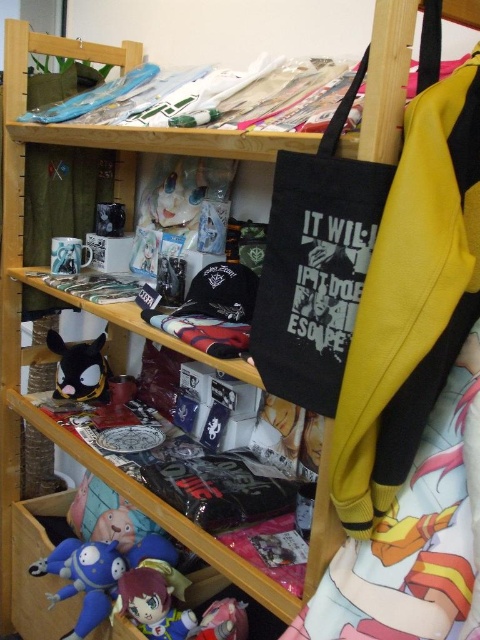
Question: Which of the following is the farthest from the observer?

Choices:
 (A) plush toy at lower center
 (B) matte black plush toy at lower left

Answer: (B)

Question: Observing the image, what is the correct spatial positioning of black canvas tote at upper right in reference to matte pink plush at lower center?

Choices:
 (A) right
 (B) left

Answer: (A)

Question: Does blue plush toy at lower left appear under matte black plush toy at lower left?

Choices:
 (A) yes
 (B) no

Answer: (A)

Question: Does plush toy at lower center have a larger size compared to matte pink plush at lower center?

Choices:
 (A) yes
 (B) no

Answer: (A)

Question: Which of the following is the farthest from the observer?

Choices:
 (A) tap(231, 621)
 (B) tap(301, 301)
 (C) tap(162, 609)
 (D) tap(100, 364)

Answer: (D)

Question: Considering the real-world distances, which object is closest to the matte black plush toy at lower left?

Choices:
 (A) blue plush toy at lower left
 (B) black canvas tote at upper right

Answer: (A)